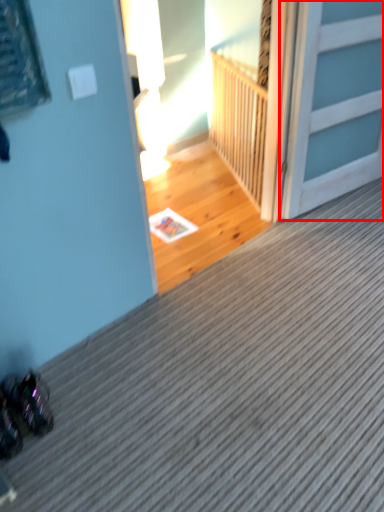
Question: Observing the image, what is the correct spatial positioning of door (annotated by the red box) in reference to balustrade?

Choices:
 (A) right
 (B) left

Answer: (A)